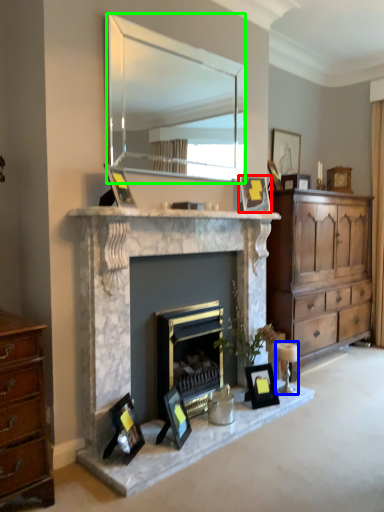
Question: Which object is positioned closest to picture frame (highlighted by a red box)? Select from candle holder (highlighted by a blue box) and mirror (highlighted by a green box).

Choices:
 (A) candle holder
 (B) mirror

Answer: (A)